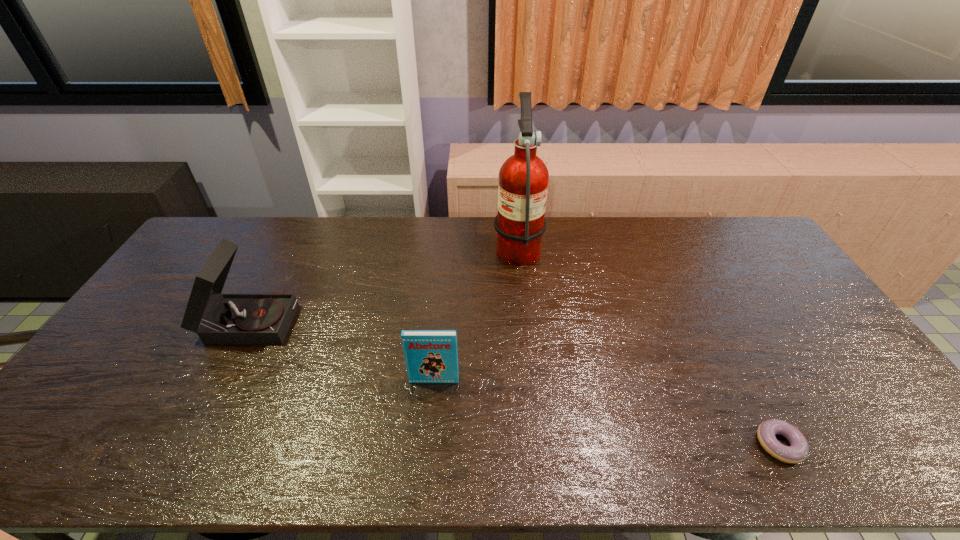
Identify the location of vacant region at the far left corner of the desktop. pyautogui.click(x=204, y=249).

The image size is (960, 540). In order to click on free area in between the third object from left to right and the third object from right to left in this screenshot , I will do `click(476, 313)`.

The height and width of the screenshot is (540, 960). Find the location of `free space between the tallest object and the second tallest object`. free space between the tallest object and the second tallest object is located at coordinates (384, 282).

Where is `free space between the farthest object and the rightmost object`? Image resolution: width=960 pixels, height=540 pixels. free space between the farthest object and the rightmost object is located at coordinates (648, 345).

The height and width of the screenshot is (540, 960). I want to click on vacant area that lies between the tallest object and the phonograph_record, so click(384, 282).

Where is `free space between the second object from left to right and the third object from left to right`? free space between the second object from left to right and the third object from left to right is located at coordinates (476, 313).

Locate an element on the screen. The height and width of the screenshot is (540, 960). vacant space that's between the third nearest object and the rightmost object is located at coordinates (515, 382).

I want to click on free spot between the shortest object and the third tallest object, so click(607, 413).

I want to click on blank region between the third object from right to left and the leftmost object, so click(343, 350).

The image size is (960, 540). I want to click on free space between the book and the rightmost object, so click(607, 413).